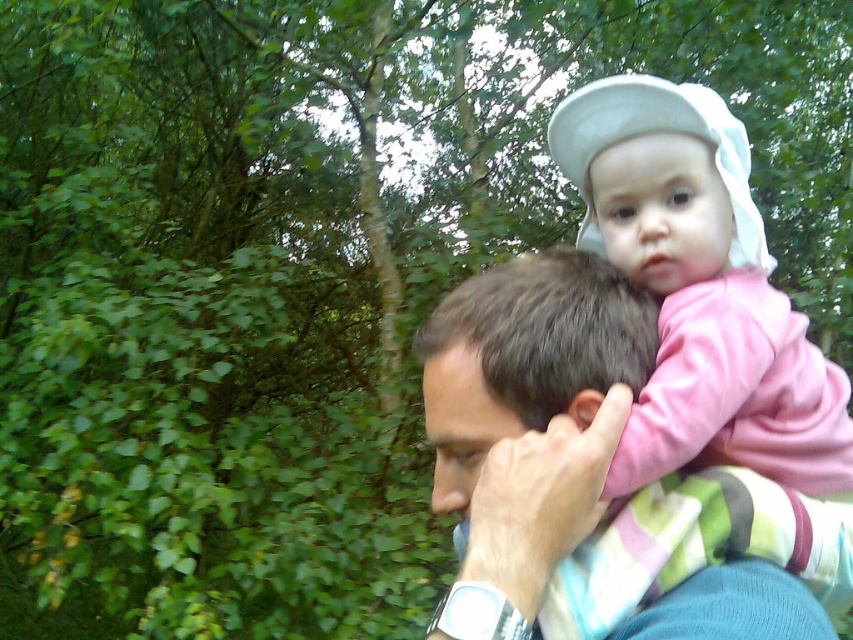
Is point (788, 460) behind point (491, 289)?

Yes, it is.

Find the location of a particular element. pink fabric baby at upper right is located at coordinates (700, 291).

Where is `pink fabric baby at upper right`? pink fabric baby at upper right is located at coordinates (700, 291).

Can you confirm if smooth blue shirt at center is thinner than dark brown hair at center?

In fact, smooth blue shirt at center might be wider than dark brown hair at center.

Does smooth blue shirt at center appear on the left side of dark brown hair at center?

No, smooth blue shirt at center is not to the left of dark brown hair at center.

Which is behind, point (608, 380) or point (462, 333)?

The point (608, 380) is more distant.

What are the coordinates of `smooth blue shirt at center` in the screenshot? It's located at (526, 356).

Between pink fabric baby at upper right and blue knitted sweater at upper right, which one is positioned lower?

blue knitted sweater at upper right is lower down.

Can you confirm if pink fabric baby at upper right is positioned above blue knitted sweater at upper right?

Indeed, pink fabric baby at upper right is positioned over blue knitted sweater at upper right.

The width and height of the screenshot is (853, 640). In order to click on pink fabric baby at upper right in this screenshot , I will do `click(700, 291)`.